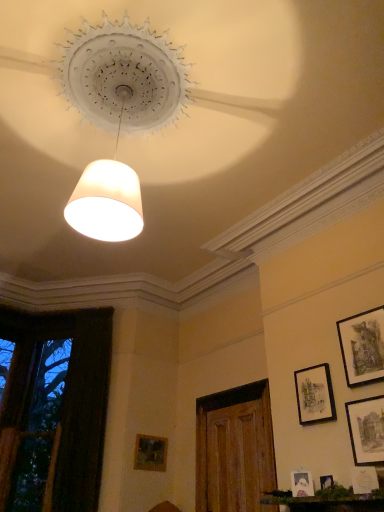
Question: Is matte black picture frame at lower right, acting as the 4th picture frame starting from the left, facing away from matte white picture frame at lower right, arranged as the 3th picture frame when viewed from the front?

Choices:
 (A) no
 (B) yes

Answer: (A)

Question: Is matte black picture frame at lower right, acting as the sixth picture frame starting from the front, positioned before matte white picture frame at lower right, the second picture frame in the left-to-right sequence?

Choices:
 (A) no
 (B) yes

Answer: (A)

Question: Is matte black picture frame at lower right, acting as the sixth picture frame starting from the front, positioned far away from matte white picture frame at lower right, the second picture frame in the left-to-right sequence?

Choices:
 (A) no
 (B) yes

Answer: (A)

Question: Is matte black picture frame at lower right, acting as the 4th picture frame starting from the left, shorter than matte white picture frame at lower right, arranged as the 3th picture frame when viewed from the front?

Choices:
 (A) yes
 (B) no

Answer: (B)

Question: Is matte black picture frame at lower right, acting as the sixth picture frame starting from the front, facing towards matte white picture frame at lower right, which is the 6th picture frame in right-to-left order?

Choices:
 (A) no
 (B) yes

Answer: (A)

Question: From the image's perspective, relative to matte white picture frame at lower right, the 7th picture frame positioned from the back, is matte black picture frame at lower right, which is counted as the second picture frame, starting from the back, above or below?

Choices:
 (A) above
 (B) below

Answer: (A)

Question: From a real-world perspective, relative to matte white picture frame at lower right, the 7th picture frame positioned from the back, is matte black picture frame at lower right, which is the 4th picture frame in right-to-left order, vertically above or below?

Choices:
 (A) below
 (B) above

Answer: (B)

Question: Is point (306, 394) closer or farther from the camera than point (360, 483)?

Choices:
 (A) closer
 (B) farther

Answer: (B)

Question: Based on their positions, is matte black picture frame at lower right, which is counted as the second picture frame, starting from the back, located to the left or right of matte white picture frame at lower right, which is counted as the 1th picture frame, starting from the front?

Choices:
 (A) left
 (B) right

Answer: (A)

Question: Is point (100, 433) closer or farther from the camera than point (304, 480)?

Choices:
 (A) closer
 (B) farther

Answer: (B)

Question: Considering the positions of transparent glass window at left and matte white picture frame at lower right, which is the 6th picture frame in right-to-left order, in the image, is transparent glass window at left taller or shorter than matte white picture frame at lower right, which is the 6th picture frame in right-to-left order,?

Choices:
 (A) tall
 (B) short

Answer: (A)

Question: Considering their positions, is transparent glass window at left located in front of or behind matte white picture frame at lower right, arranged as the 5th picture frame when viewed from the back?

Choices:
 (A) behind
 (B) front

Answer: (A)

Question: From a real-world perspective, is transparent glass window at left above or below matte white picture frame at lower right, the second picture frame in the left-to-right sequence?

Choices:
 (A) below
 (B) above

Answer: (B)

Question: Is matte black picture frame at lower right, positioned as the 3th picture frame in left-to-right order, inside the boundaries of wooden picture frame at lower center, which appears as the first picture frame when viewed from the back, or outside?

Choices:
 (A) outside
 (B) inside

Answer: (A)

Question: Considering the positions of matte black picture frame at lower right, acting as the fifth picture frame starting from the right, and wooden picture frame at lower center, which appears as the first picture frame when viewed from the back, in the image, is matte black picture frame at lower right, acting as the fifth picture frame starting from the right, bigger or smaller than wooden picture frame at lower center, which appears as the first picture frame when viewed from the back,?

Choices:
 (A) small
 (B) big

Answer: (A)